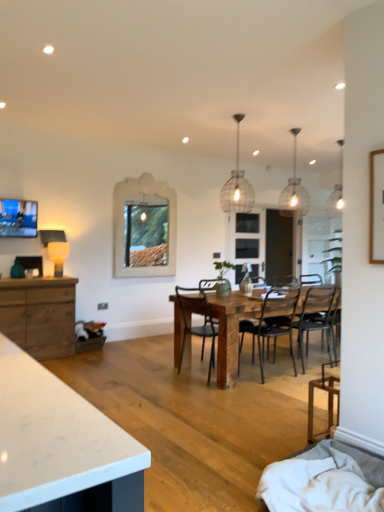
Find the location of `vacant area that is in front of metallic black chair at center, which appears as the second chair when viewed from the front`. vacant area that is in front of metallic black chair at center, which appears as the second chair when viewed from the front is located at coordinates (204, 393).